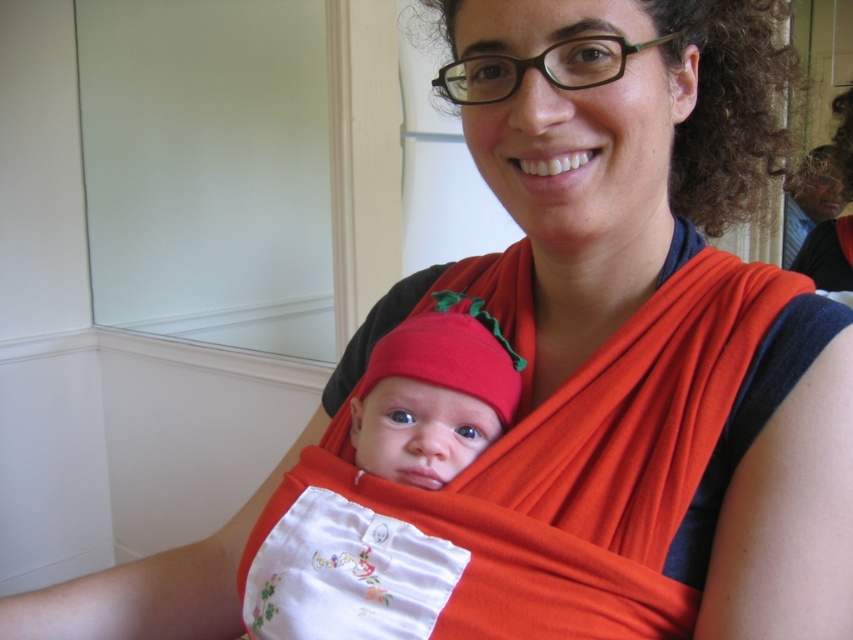
Question: Among these objects, which one is nearest to the camera?

Choices:
 (A) matte red fabric baby at center
 (B) white embroidered bib at center

Answer: (B)

Question: Can you confirm if white embroidered bib at center is bigger than matte red fabric baby at center?

Choices:
 (A) no
 (B) yes

Answer: (B)

Question: Among these objects, which one is nearest to the camera?

Choices:
 (A) matte red fabric baby at center
 (B) white embroidered bib at center

Answer: (B)

Question: Is white embroidered bib at center to the right of matte red fabric baby at center from the viewer's perspective?

Choices:
 (A) no
 (B) yes

Answer: (B)

Question: From the image, what is the correct spatial relationship of white embroidered bib at center in relation to matte red fabric baby at center?

Choices:
 (A) left
 (B) right

Answer: (B)

Question: Which of the following is the farthest from the observer?

Choices:
 (A) (643, 620)
 (B) (440, 442)

Answer: (B)